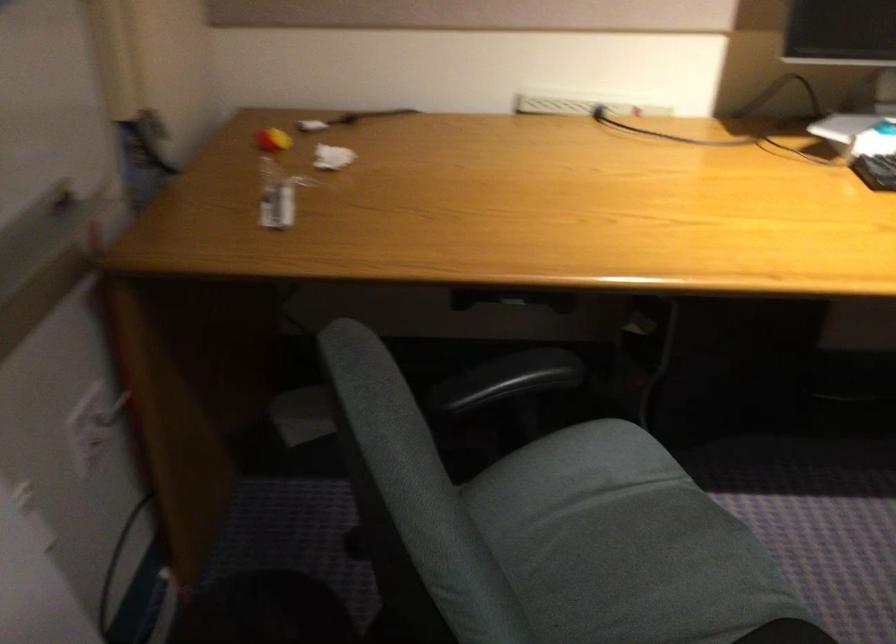
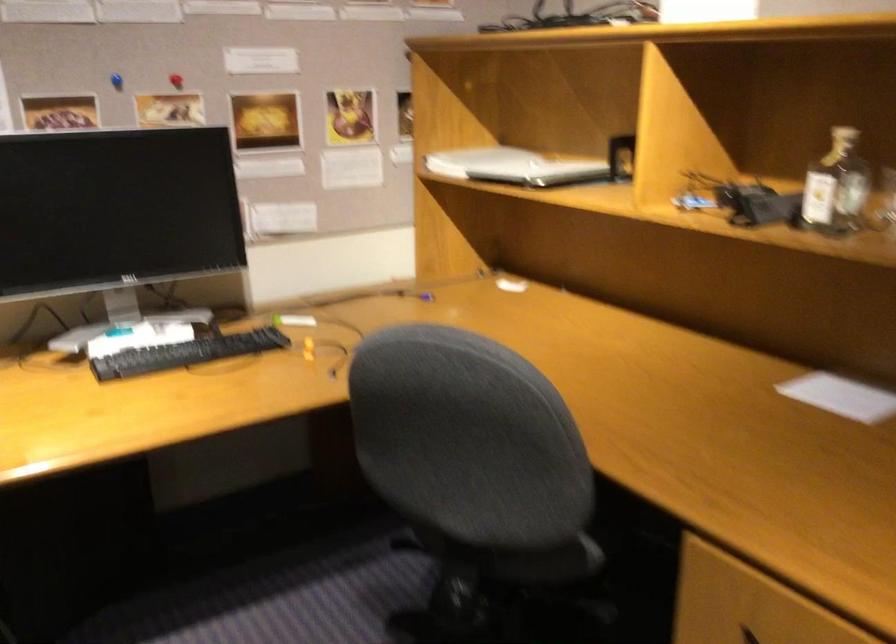
Question: The camera is either moving clockwise (left) or counter-clockwise (right) around the object. The first image is from the beginning of the video and the second image is from the end. Is the camera moving left or right when shooting the video?

Choices:
 (A) Left
 (B) Right

Answer: (A)